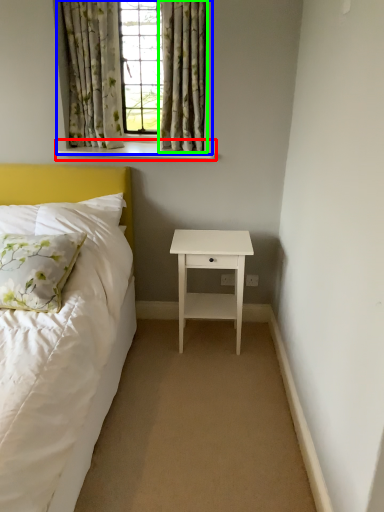
Question: Based on their relative distances, which object is nearer to window sill (highlighted by a red box)? Choose from window (highlighted by a blue box) and curtain (highlighted by a green box).

Choices:
 (A) window
 (B) curtain

Answer: (A)